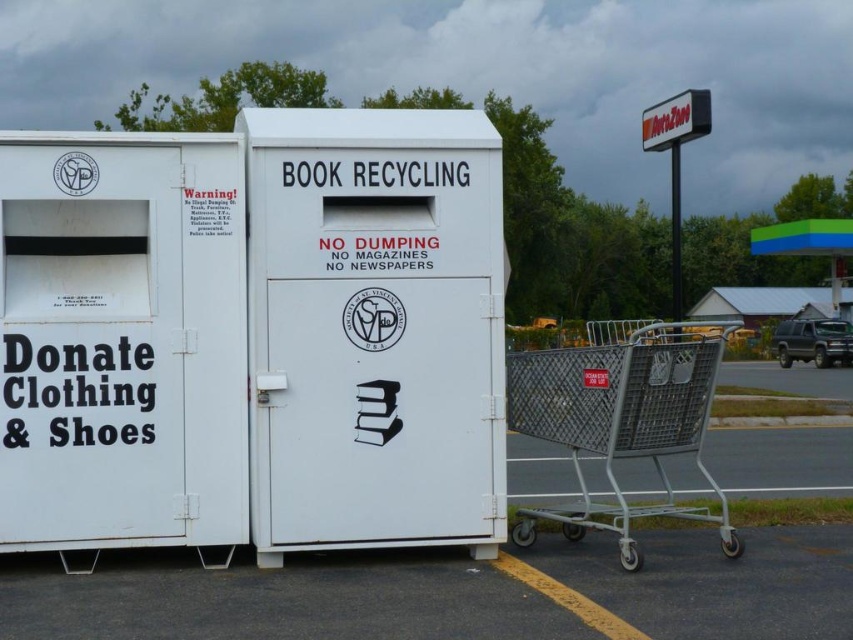
Can you confirm if white metal shopping cart at lower right is wider than white plastic sign at upper center?

No.

Who is shorter, white metal shopping cart at lower right or white plastic sign at upper center?

Standing shorter between the two is white metal shopping cart at lower right.

Does point (410, 592) come in front of point (695, 109)?

Yes, it is in front of point (695, 109).

Identify the location of white metal shopping cart at lower right. (498, 577).

Looking at this image, between white metal shopping cart at lower right and metallic gray shopping cart at lower right, which one appears on the left side from the viewer's perspective?

white metal shopping cart at lower right is more to the left.

Can you confirm if white metal shopping cart at lower right is positioned to the right of metallic gray shopping cart at lower right?

In fact, white metal shopping cart at lower right is to the left of metallic gray shopping cart at lower right.

Identify the location of white metal shopping cart at lower right. (498, 577).

Who is taller, metallic gray shopping cart at lower right or white plastic sign at upper center?

Standing taller between the two is white plastic sign at upper center.

Is metallic gray shopping cart at lower right above white plastic sign at upper center?

Actually, metallic gray shopping cart at lower right is below white plastic sign at upper center.

Is point (624, 534) closer to camera compared to point (699, 99)?

Yes.

I want to click on metallic gray shopping cart at lower right, so click(621, 420).